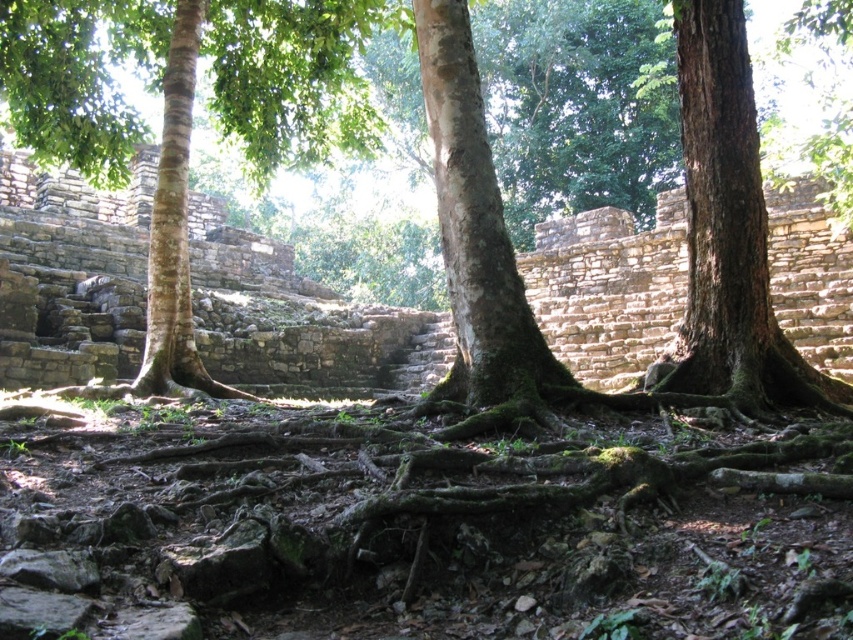
Is point (192, 83) farther from viewer compared to point (695, 49)?

Yes, it is.

The height and width of the screenshot is (640, 853). Describe the element at coordinates (189, 113) in the screenshot. I see `brown rough tree trunk at left` at that location.

Which is in front, point (380, 26) or point (679, 10)?

Positioned in front is point (679, 10).

At what (x,y) coordinates should I click in order to perform the action: click on brown rough tree trunk at left. Please return your answer as a coordinate pair (x, y). This screenshot has height=640, width=853. Looking at the image, I should click on (189, 113).

Does brown rough tree at center appear on the right side of brown rough tree trunk at left?

Yes, brown rough tree at center is to the right of brown rough tree trunk at left.

Is point (693, 51) more distant than point (165, 336)?

No, it is not.

Locate an element on the screen. brown rough tree at center is located at coordinates (271, 141).

Does point (331, 36) come behind point (682, 339)?

That is True.

Does brown rough tree at center come in front of green rough bark tree at center?

Yes, brown rough tree at center is closer to the viewer.

Identify the location of brown rough tree at center. (271, 141).